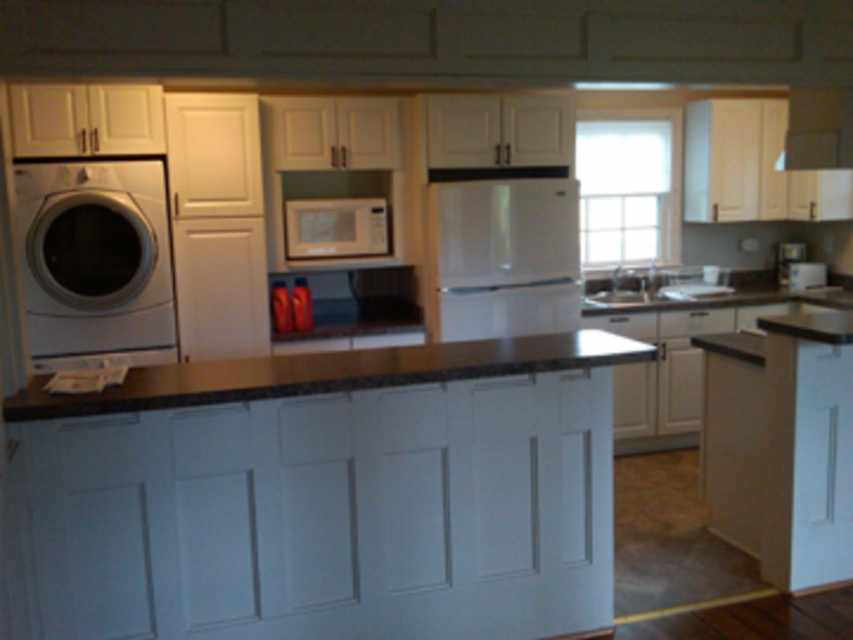
Looking at this image, you are moving into a new apartment and need to know if the white glossy washing machine at left can be moved behind the satin white refrigerator at center. Based on their current positions, is this possible?

The white glossy washing machine at left is currently in front of the satin white refrigerator at center, so it can be moved behind the refrigerator if there is enough space and clearance.

Based on the photo, you are a delivery person trying to deliver a new dishwasher that is 5 feet wide. You need to place it between the white glossy washing machine at left and the satin white refrigerator at center. Will there be enough space for the dishwasher?

The distance between the white glossy washing machine at left and the satin white refrigerator at center is 5.49 feet. Since the dishwasher is 5 feet wide, there is enough space to place it between them as the available space is slightly larger than the dishwasher.

You are a kitchen designer planning to install a new dishwasher. You see the white glossy washing machine at left and the white glossy sink at center. Which object is closer to the front of the kitchen layout?

The white glossy washing machine at left is closer to the front of the kitchen layout because it is in front of the white glossy sink at center.